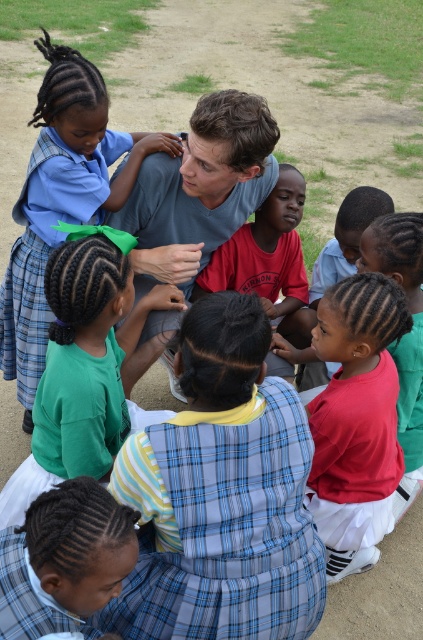
Question: Which is nearer to the matte blue skirt at upper left?

Choices:
 (A) plaid fabric skirt at lower left
 (B) light blue cotton shirt at center

Answer: (B)

Question: Does light blue cotton shirt at center lie behind plaid fabric skirt at lower left?

Choices:
 (A) yes
 (B) no

Answer: (A)

Question: Is matte blue skirt at upper left to the right of plaid fabric skirt at lower left from the viewer's perspective?

Choices:
 (A) no
 (B) yes

Answer: (A)

Question: Which point is closer to the camera taking this photo?

Choices:
 (A) (0, 604)
 (B) (242, 298)
 (C) (200, 147)

Answer: (A)

Question: Among these points, which one is farthest from the camera?

Choices:
 (A) (382, 417)
 (B) (41, 204)

Answer: (B)

Question: Is blue plaid dress at center behind matte blue skirt at upper left?

Choices:
 (A) yes
 (B) no

Answer: (B)